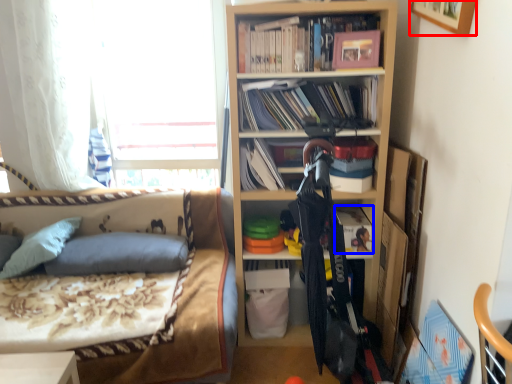
Question: Which of the following is the closest to the observer, picture frame (highlighted by a red box) or book (highlighted by a blue box)?

Choices:
 (A) picture frame
 (B) book

Answer: (A)